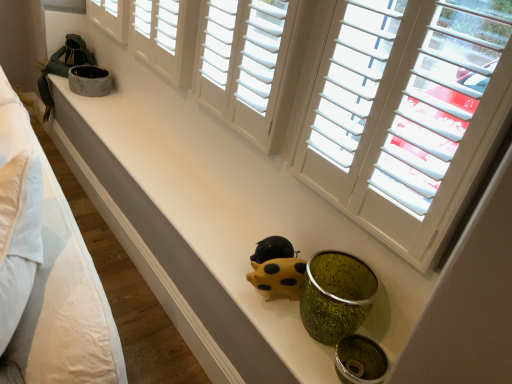
Identify the location of white wood shutters at upper center, which appears as the second window when viewed from the right. This screenshot has width=512, height=384. (249, 65).

Is white wood shutters at upper center, the first window viewed from the left, in front of or behind white cotton bed at left in the image?

Clearly, white wood shutters at upper center, the first window viewed from the left, is behind white cotton bed at left.

Considering the points (274, 12) and (103, 382), which point is behind, point (274, 12) or point (103, 382)?

The point (274, 12) is more distant.

From a real-world perspective, is white wood shutters at upper center, which appears as the second window when viewed from the right, physically located above or below white cotton bed at left?

white wood shutters at upper center, which appears as the second window when viewed from the right, is situated higher than white cotton bed at left in the real world.

Between white wood shutters at upper center, which appears as the second window when viewed from the right, and white cotton bed at left, which one has less height?

Standing shorter between the two is white wood shutters at upper center, which appears as the second window when viewed from the right.

Where is `counter top located on the left of white wood shutters at upper center, which appears as the second window when viewed from the right`? counter top located on the left of white wood shutters at upper center, which appears as the second window when viewed from the right is located at coordinates (228, 226).

Considering the relative positions of matte white counter top at center and white wood shutters at upper center, the first window viewed from the left, in the image provided, is matte white counter top at center in front of white wood shutters at upper center, the first window viewed from the left,?

Yes, the depth of matte white counter top at center is less than that of white wood shutters at upper center, the first window viewed from the left.

Between matte white counter top at center and white wood shutters at upper center, which appears as the second window when viewed from the right, which one has less height?

matte white counter top at center is shorter.

Considering the relative sizes of matte white counter top at center and white wood shutters at upper center, the first window viewed from the left, in the image provided, is matte white counter top at center bigger than white wood shutters at upper center, the first window viewed from the left,?

Yes, matte white counter top at center is bigger than white wood shutters at upper center, the first window viewed from the left.

Consider the image. What's the angular difference between matte white counter top at center and white cotton bed at left's facing directions?

They differ by 30.3 degrees in their facing directions.

Can you see matte white counter top at center touching white cotton bed at left?

No, matte white counter top at center is not making contact with white cotton bed at left.

Which object is closer to the camera taking this photo, matte white counter top at center or white cotton bed at left?

white cotton bed at left is closer to the camera.

Could you tell me if matte white counter top at center is facing white cotton bed at left?

No, matte white counter top at center is not aimed at white cotton bed at left.

Which of these two, yellow matte piggy bank at center or matte white counter top at center, is smaller?

With smaller size is yellow matte piggy bank at center.

Which is nearer, (257, 275) or (315, 362)?

Point (257, 275).

Measure the distance from yellow matte piggy bank at center to matte white counter top at center.

yellow matte piggy bank at center and matte white counter top at center are 43.55 centimeters apart from each other.

Is yellow matte piggy bank at center wider or thinner than matte white counter top at center?

Clearly, yellow matte piggy bank at center has less width compared to matte white counter top at center.

Does point (283, 239) come farther from viewer compared to point (115, 347)?

Yes, point (283, 239) is behind point (115, 347).

Would you say yellow matte piggy bank at center is a long distance from white cotton bed at left?

Actually, yellow matte piggy bank at center and white cotton bed at left are a little close together.

Find the location of a particular element. Image resolution: width=512 pixels, height=384 pixels. figurine behind the white cotton bed at left is located at coordinates (277, 269).

From the image's perspective, is yellow matte piggy bank at center located above or below white cotton bed at left?

Answer: From the image's perspective, yellow matte piggy bank at center appears below white cotton bed at left.

Between point (48, 184) and point (262, 118), which one is positioned behind?

The point (262, 118) is farther from the camera.

From the image's perspective, is white cotton bed at left located above or below white wood shutters at upper center, which appears as the second window when viewed from the right?

Clearly, from the image's perspective, white cotton bed at left is below white wood shutters at upper center, which appears as the second window when viewed from the right.

Does white cotton bed at left have a greater height compared to white wood shutters at upper center, the first window viewed from the left?

Yes.

Could you tell me if white cotton bed at left is turned towards white wood shutters at upper center, the first window viewed from the left?

No, white cotton bed at left is not oriented towards white wood shutters at upper center, the first window viewed from the left.

Are white matte window at upper center, positioned as the first window in right-to-left order, and yellow matte piggy bank at center far apart?

white matte window at upper center, positioned as the first window in right-to-left order, is near yellow matte piggy bank at center, not far away.

Could yellow matte piggy bank at center be considered to be inside white matte window at upper center, which is counted as the second window, starting from the left?

Actually, yellow matte piggy bank at center is outside white matte window at upper center, which is counted as the second window, starting from the left.

Does white matte window at upper center, positioned as the first window in right-to-left order, have a greater height compared to yellow matte piggy bank at center?

Yes.

Image resolution: width=512 pixels, height=384 pixels. Identify the location of bed below the white wood shutters at upper center, which appears as the second window when viewed from the right (from a real-world perspective). (59, 283).

In the image, there is a white wood shutters at upper center, which appears as the second window when viewed from the right. At what (x,y) coordinates should I click in order to perform the action: click on counter top below it (from the image's perspective). Please return your answer as a coordinate pair (x, y). Looking at the image, I should click on (228, 226).

From the image, which object appears to be farther from white cotton bed at left, white matte window at upper center, positioned as the first window in right-to-left order, or white wood shutters at upper center, the first window viewed from the left?

white matte window at upper center, positioned as the first window in right-to-left order, is further to white cotton bed at left.

Estimate the real-world distances between objects in this image. Which object is closer to yellow matte piggy bank at center, white cotton bed at left or white matte window at upper center, positioned as the first window in right-to-left order?

Based on the image, white matte window at upper center, positioned as the first window in right-to-left order, appears to be nearer to yellow matte piggy bank at center.

Looking at the image, which one is located closer to matte white counter top at center, white matte window at upper center, which is counted as the second window, starting from the left, or white wood shutters at upper center, which appears as the second window when viewed from the right?

Based on the image, white matte window at upper center, which is counted as the second window, starting from the left, appears to be nearer to matte white counter top at center.

Looking at the image, which one is located further to yellow matte piggy bank at center, white wood shutters at upper center, the first window viewed from the left, or white cotton bed at left?

Among the two, white cotton bed at left is located further to yellow matte piggy bank at center.

Considering their positions, is yellow matte piggy bank at center positioned closer to white matte window at upper center, positioned as the first window in right-to-left order, than matte white counter top at center?

Among the two, matte white counter top at center is located nearer to white matte window at upper center, positioned as the first window in right-to-left order.

Considering their positions, is white cotton bed at left positioned further to matte white counter top at center than white wood shutters at upper center, the first window viewed from the left?

Based on the image, white cotton bed at left appears to be further to matte white counter top at center.

When comparing their distances from white wood shutters at upper center, the first window viewed from the left, does white matte window at upper center, which is counted as the second window, starting from the left, or matte white counter top at center seem closer?

Among the two, white matte window at upper center, which is counted as the second window, starting from the left, is located nearer to white wood shutters at upper center, the first window viewed from the left.

When comparing their distances from white matte window at upper center, positioned as the first window in right-to-left order, does white wood shutters at upper center, the first window viewed from the left, or yellow matte piggy bank at center seem closer?

white wood shutters at upper center, the first window viewed from the left, is positioned closer to the anchor white matte window at upper center, positioned as the first window in right-to-left order.

Find the location of a particular element. counter top between white wood shutters at upper center, the first window viewed from the left, and yellow matte piggy bank at center, in the vertical direction is located at coordinates (228, 226).

The height and width of the screenshot is (384, 512). Identify the location of figurine located between white cotton bed at left and white matte window at upper center, positioned as the first window in right-to-left order, in the left-right direction. (277, 269).

Identify the location of counter top positioned between white cotton bed at left and yellow matte piggy bank at center from near to far. Image resolution: width=512 pixels, height=384 pixels. (228, 226).

Locate an element on the screen. This screenshot has width=512, height=384. counter top between white cotton bed at left and white matte window at upper center, which is counted as the second window, starting from the left, in the horizontal direction is located at coordinates (228, 226).